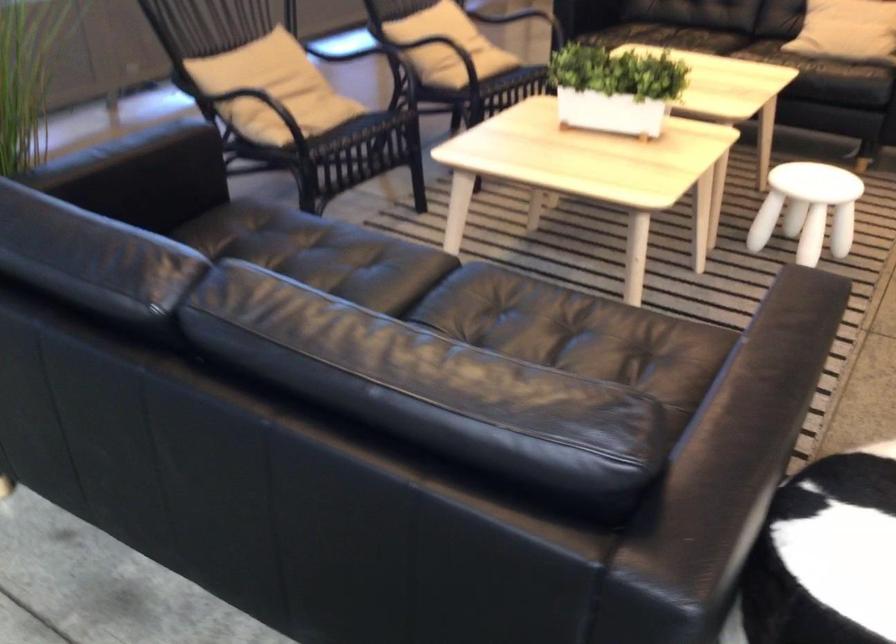
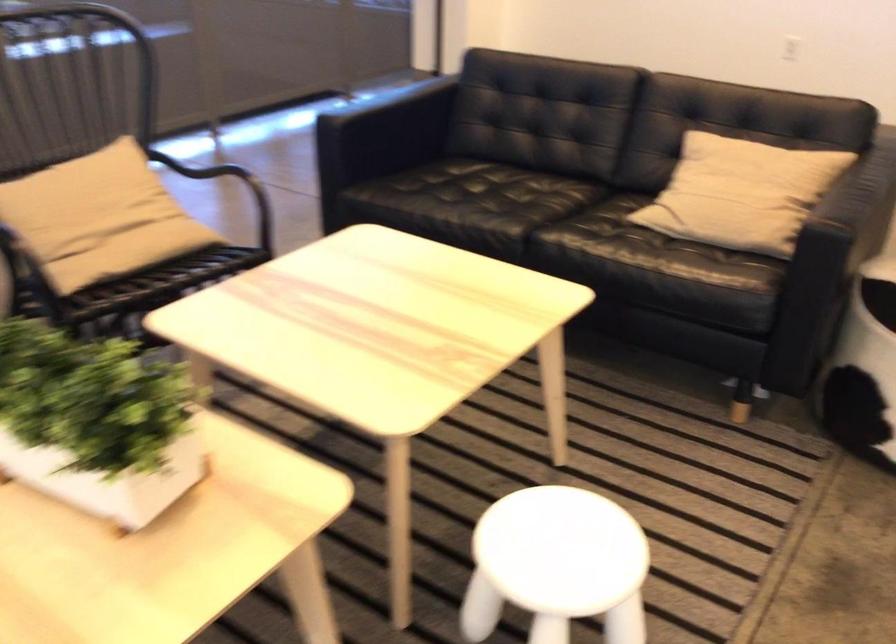
In the second image, find the point that corresponds to (645,79) in the first image.

(96, 422)